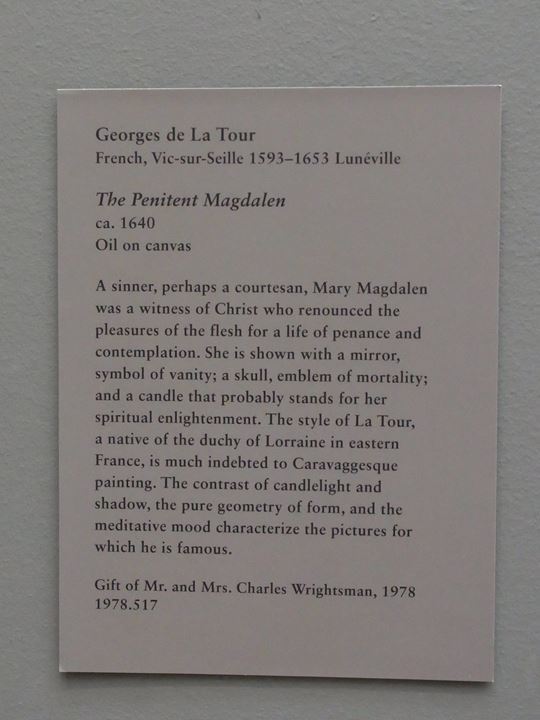
Image resolution: width=540 pixels, height=720 pixels. I want to click on white painted textured wall, so click(x=253, y=44).